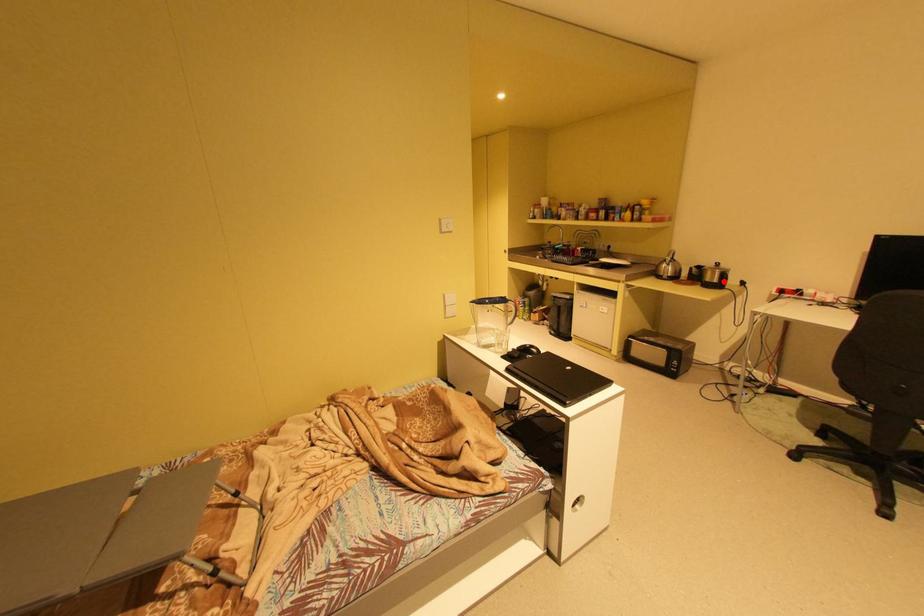
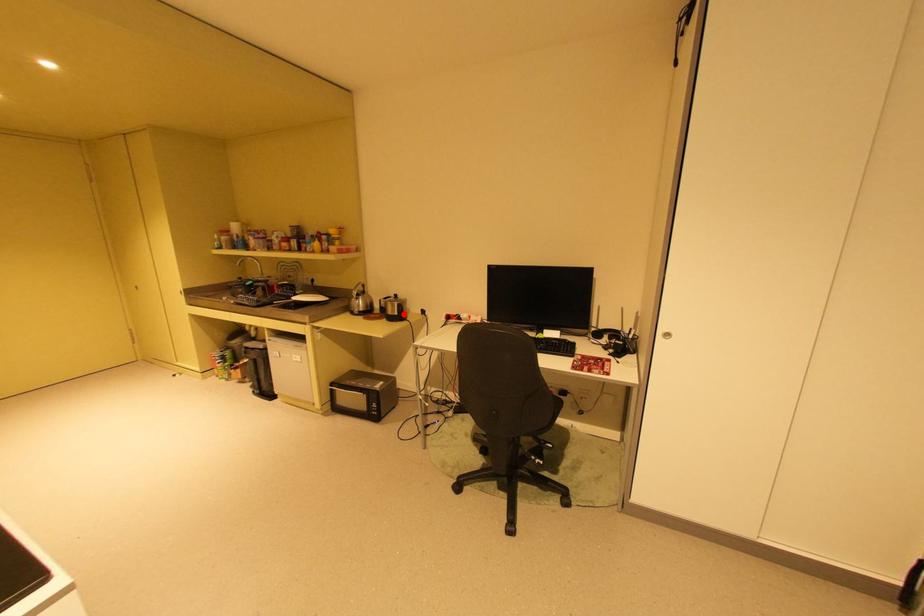
Based on the photo, I am providing you with two images of the same scene from different viewpoints. A red point is marked on the first image and another point is marked on the second image. Is the marked point in image1 the same physical position as the marked point in image2?

Yes